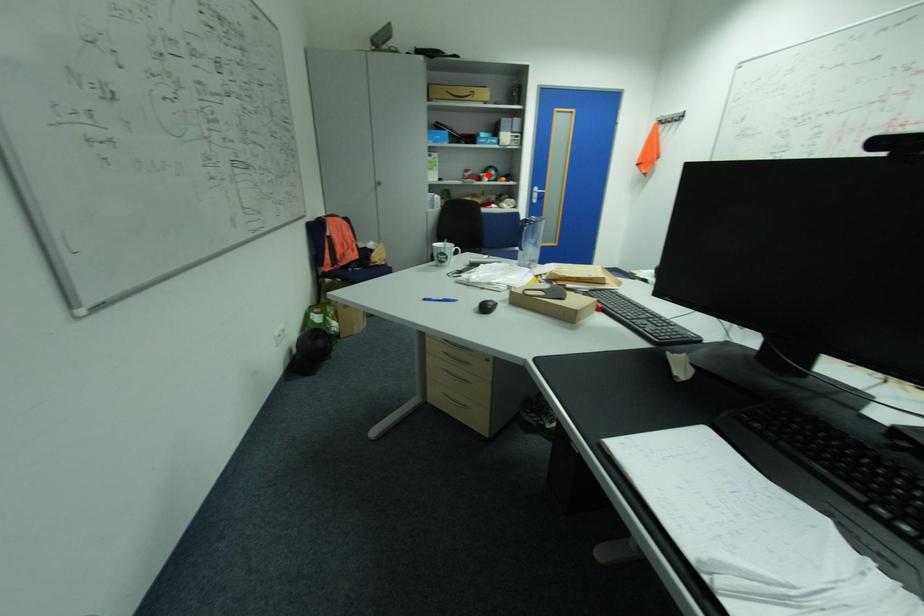
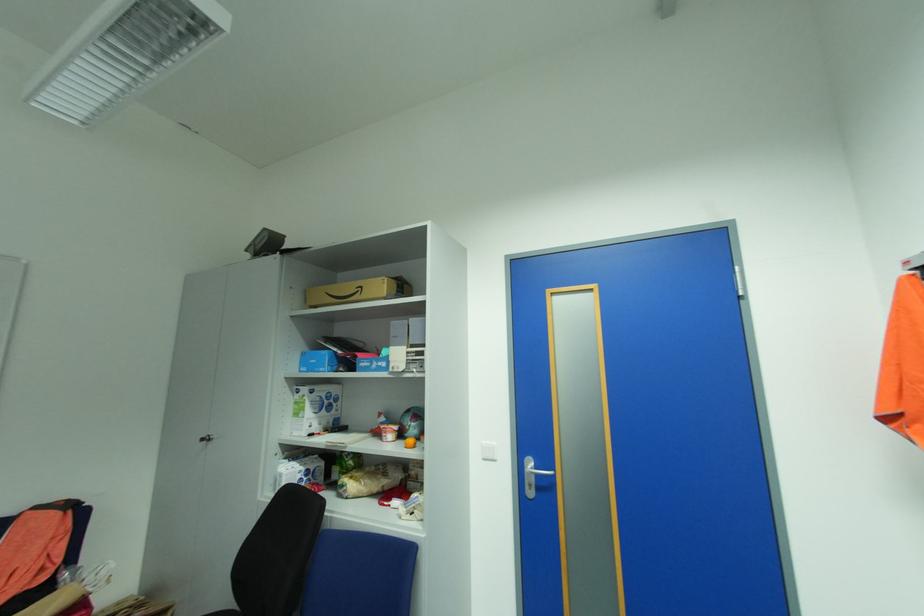
Find the pixel in the second image that matches the highlighted location in the first image.

(388, 427)